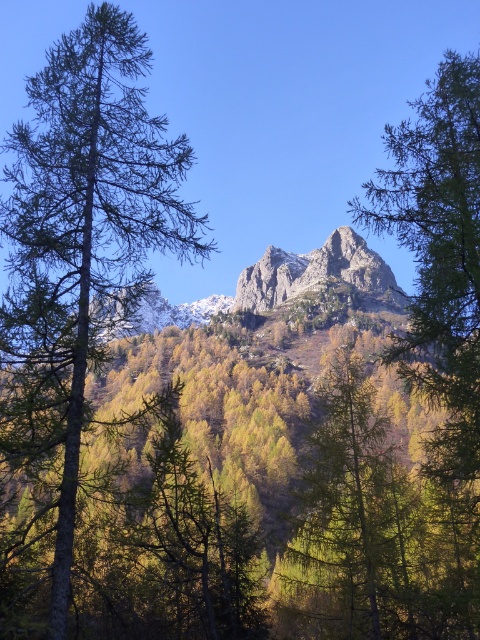
Question: Which object appears farthest from the camera in this image?

Choices:
 (A) rugged stone mountain at center
 (B) green needle-like tree at left

Answer: (A)

Question: Which of the following is the farthest from the observer?

Choices:
 (A) (24, 196)
 (B) (248, 291)

Answer: (B)

Question: Can you confirm if green needle-like tree at left is positioned to the left of rugged stone mountain at center?

Choices:
 (A) yes
 (B) no

Answer: (A)

Question: Can you confirm if green needle-like tree at left is wider than rugged stone mountain at center?

Choices:
 (A) yes
 (B) no

Answer: (B)

Question: Which point is farther to the camera?

Choices:
 (A) rugged stone mountain at center
 (B) green needle-like tree at left

Answer: (A)

Question: Does green needle-like tree at left appear under rugged stone mountain at center?

Choices:
 (A) no
 (B) yes

Answer: (A)